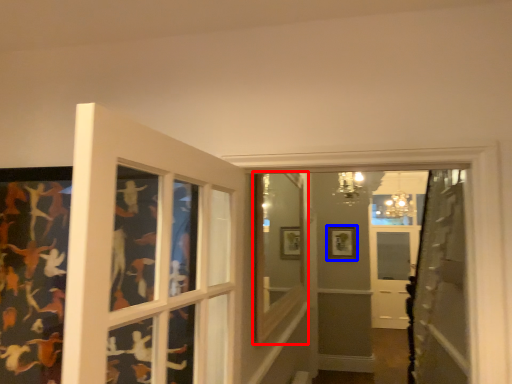
Question: Which point is further to the camera, window frame (highlighted by a red box) or picture frame (highlighted by a blue box)?

Choices:
 (A) window frame
 (B) picture frame

Answer: (B)